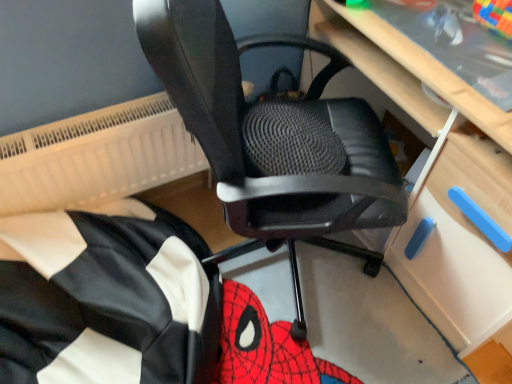
Find the location of a particular element. This screenshot has height=384, width=512. free region under black mesh office chair at center (from a real-world perspective) is located at coordinates (285, 270).